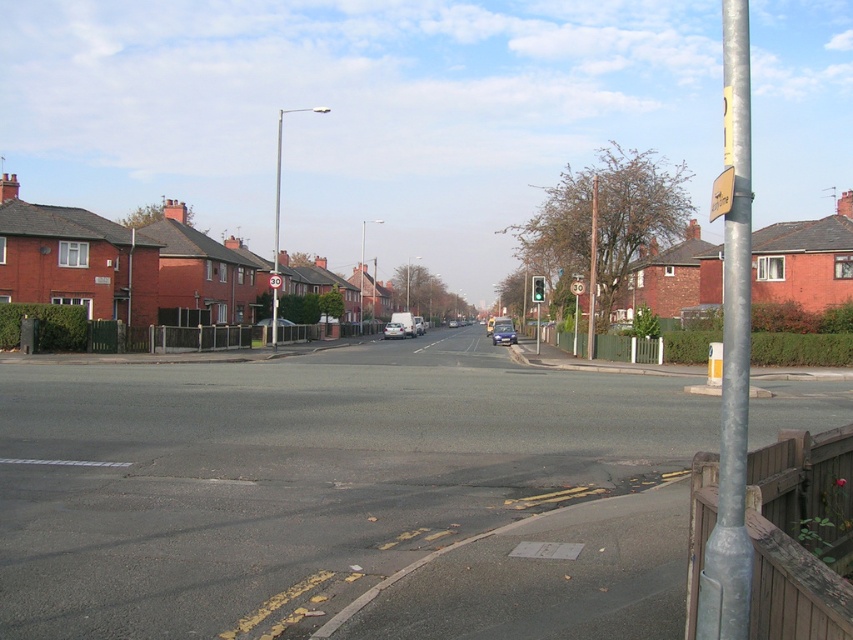
Is point (541, 291) less distant than point (271, 282)?

No, (541, 291) is behind (271, 282).

Can you confirm if green glass traffic light at center is smaller than red plastic sign at center?

No.

The height and width of the screenshot is (640, 853). What do you see at coordinates (537, 289) in the screenshot?
I see `green glass traffic light at center` at bounding box center [537, 289].

You are a GUI agent. You are given a task and a screenshot of the screen. Output one action in this format:
    pyautogui.click(x=<x>, y=<y>)
    Task: Click on the green glass traffic light at center
    This screenshot has width=853, height=640.
    Given the screenshot: What is the action you would take?
    pyautogui.click(x=537, y=289)

Who is more distant from viewer, (274, 228) or (502, 333)?

Point (274, 228)

From the picture: Who is more forward, (277, 259) or (514, 336)?

Point (514, 336) is in front.

Locate an element on the screen. This screenshot has height=640, width=853. metallic pole at center is located at coordinates (277, 193).

Is metallic silver car at center bigger than green glass traffic light at center?

Incorrect, metallic silver car at center is not larger than green glass traffic light at center.

How far apart are metallic silver car at center and green glass traffic light at center?

29.56 feet

Where is `metallic silver car at center`? The height and width of the screenshot is (640, 853). metallic silver car at center is located at coordinates (503, 333).